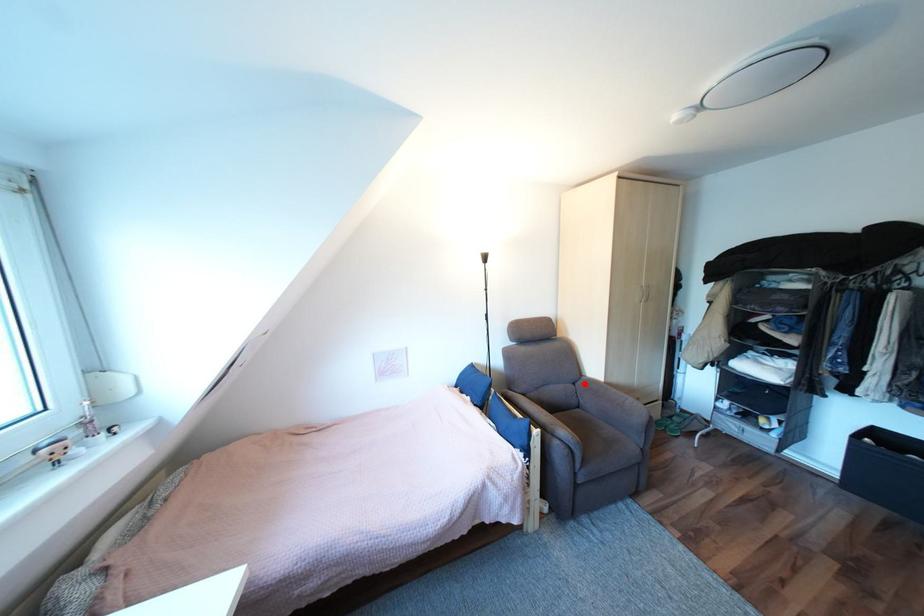
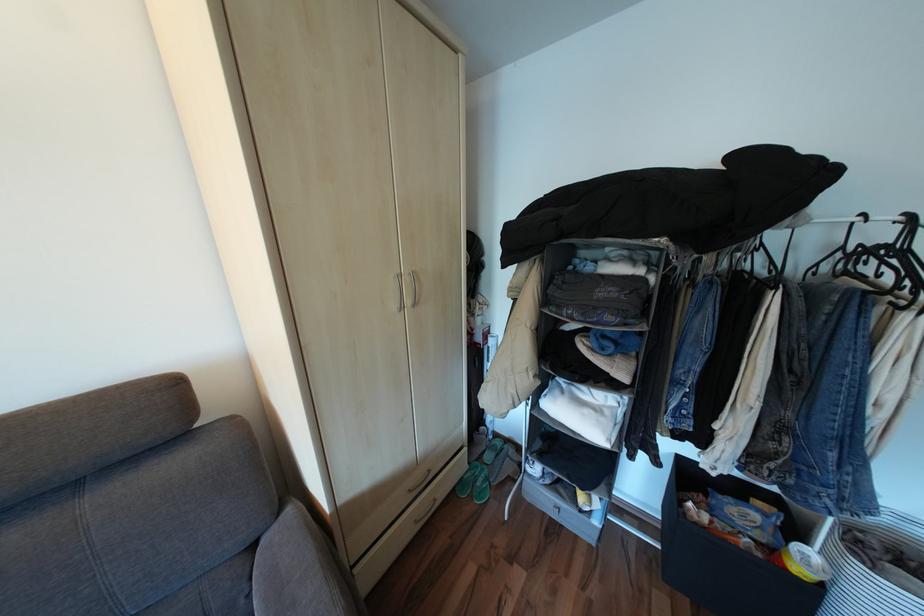
The point at the highlighted location is marked in the first image. Where is the corresponding point in the second image?

(263, 545)